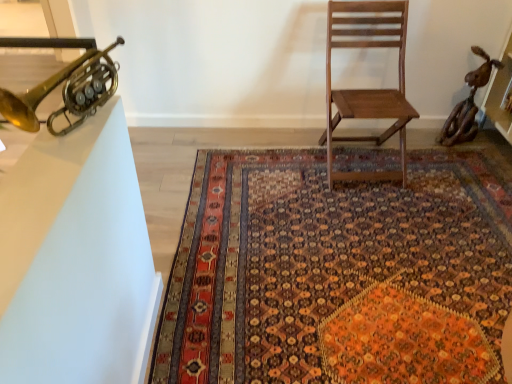
This screenshot has width=512, height=384. Identify the location of carpet with intricate patterns at center. (338, 273).

Image resolution: width=512 pixels, height=384 pixels. What do you see at coordinates (76, 260) in the screenshot? I see `white glossy table at left` at bounding box center [76, 260].

Where is `carpet with intricate patterns at center`? The image size is (512, 384). carpet with intricate patterns at center is located at coordinates (338, 273).

Which of these two, carpet with intricate patterns at center or white glossy table at left, is thinner?

white glossy table at left.

In the scene shown: Which object is further away from the camera taking this photo, carpet with intricate patterns at center or white glossy table at left?

carpet with intricate patterns at center is further away from the camera.

Is carpet with intricate patterns at center taller than white glossy table at left?

Correct, carpet with intricate patterns at center is much taller as white glossy table at left.

Does wooden chair at center have a greater width compared to white glossy table at left?

Yes.

Could you tell me if wooden chair at center is turned towards white glossy table at left?

No, wooden chair at center does not turn towards white glossy table at left.

Does point (327, 68) appear closer or farther from the camera than point (2, 319)?

Point (327, 68).

Considering the relative positions of wooden chair at center and white glossy table at left in the image provided, is wooden chair at center to the left or to the right of white glossy table at left?

In the image, wooden chair at center appears on the right side of white glossy table at left.

Is gold brass trumpet at upper left wider than carpet with intricate patterns at center?

A: No.

Is gold brass trumpet at upper left positioned with its back to carpet with intricate patterns at center?

gold brass trumpet at upper left is not turned away from carpet with intricate patterns at center.

Can you confirm if gold brass trumpet at upper left is taller than carpet with intricate patterns at center?

Indeed, gold brass trumpet at upper left has a greater height compared to carpet with intricate patterns at center.

Who is more distant, gold brass trumpet at upper left or carpet with intricate patterns at center?

Positioned behind is carpet with intricate patterns at center.

Is there a large distance between wooden chair at center and carpet with intricate patterns at center?

They are positioned close to each other.

From a real-world perspective, is wooden chair at center positioned above or below carpet with intricate patterns at center?

wooden chair at center is situated higher than carpet with intricate patterns at center in the real world.

Looking at the image, does wooden chair at center seem bigger or smaller compared to carpet with intricate patterns at center?

Considering their sizes, wooden chair at center takes up more space than carpet with intricate patterns at center.

How different are the orientations of wooden chair at center and carpet with intricate patterns at center in degrees?

91.6 degrees.

Is gold brass trumpet at upper left at the left side of wooden chair at center?

Indeed, gold brass trumpet at upper left is positioned on the left side of wooden chair at center.

Does gold brass trumpet at upper left touch wooden chair at center?

gold brass trumpet at upper left and wooden chair at center are not in contact.

In the image, is gold brass trumpet at upper left positioned in front of or behind wooden chair at center?

In the image, gold brass trumpet at upper left appears in front of wooden chair at center.

Considering the sizes of gold brass trumpet at upper left and wooden chair at center in the image, is gold brass trumpet at upper left taller or shorter than wooden chair at center?

gold brass trumpet at upper left is shorter than wooden chair at center.

How much distance is there between wooden chair at center and gold brass trumpet at upper left?

The distance of wooden chair at center from gold brass trumpet at upper left is 4.79 feet.

Are wooden chair at center and gold brass trumpet at upper left located far from each other?

wooden chair at center is positioned a significant distance from gold brass trumpet at upper left.

Is wooden chair at center in front of or behind gold brass trumpet at upper left in the image?

Visually, wooden chair at center is located behind gold brass trumpet at upper left.

Is point (351, 17) closer or farther from the camera than point (109, 71)?

Point (351, 17) is positioned farther from the camera compared to point (109, 71).

Looking at this image, is white glossy table at left thinner than carpet with intricate patterns at center?

Yes.

Is white glossy table at left turned away from carpet with intricate patterns at center?

No, carpet with intricate patterns at center is not at the back of white glossy table at left.

Based on the photo, which of these two, white glossy table at left or carpet with intricate patterns at center, is smaller?

Smaller between the two is white glossy table at left.

From the image's perspective, would you say white glossy table at left is positioned over carpet with intricate patterns at center?

Yes, from the image's perspective, white glossy table at left is over carpet with intricate patterns at center.

Find the location of a particular element. table located above the carpet with intricate patterns at center (from a real-world perspective) is located at coordinates (76, 260).

I want to click on chair behind the white glossy table at left, so click(368, 89).

Based on the photo, estimate the real-world distances between objects in this image. Which object is closer to gold brass trumpet at upper left, white glossy table at left or wooden chair at center?

white glossy table at left is positioned closer to the anchor gold brass trumpet at upper left.

Based on their spatial positions, is gold brass trumpet at upper left or wooden chair at center closer to carpet with intricate patterns at center?

Among the two, wooden chair at center is located nearer to carpet with intricate patterns at center.

Looking at this image, which object lies nearer to the anchor point gold brass trumpet at upper left, carpet with intricate patterns at center or white glossy table at left?

white glossy table at left lies closer to gold brass trumpet at upper left than the other object.

When comparing their distances from white glossy table at left, does wooden chair at center or carpet with intricate patterns at center seem further?

wooden chair at center is positioned further to the anchor white glossy table at left.

Based on the photo, when comparing their distances from white glossy table at left, does carpet with intricate patterns at center or wooden chair at center seem further?

The object further to white glossy table at left is wooden chair at center.

Considering their positions, is white glossy table at left positioned further to gold brass trumpet at upper left than carpet with intricate patterns at center?

carpet with intricate patterns at center lies further to gold brass trumpet at upper left than the other object.

When comparing their distances from carpet with intricate patterns at center, does gold brass trumpet at upper left or white glossy table at left seem closer?

Based on the image, white glossy table at left appears to be nearer to carpet with intricate patterns at center.

Consider the image. Based on their spatial positions, is wooden chair at center or gold brass trumpet at upper left closer to carpet with intricate patterns at center?

wooden chair at center is positioned closer to the anchor carpet with intricate patterns at center.

Where is `trumpet located between white glossy table at left and wooden chair at center in the depth direction`? The height and width of the screenshot is (384, 512). trumpet located between white glossy table at left and wooden chair at center in the depth direction is located at coordinates (66, 92).

Where is `table between gold brass trumpet at upper left and carpet with intricate patterns at center from left to right`? table between gold brass trumpet at upper left and carpet with intricate patterns at center from left to right is located at coordinates (76, 260).

Find the location of a particular element. The width and height of the screenshot is (512, 384). mat positioned between white glossy table at left and wooden chair at center from near to far is located at coordinates (338, 273).

Locate an element on the screen. This screenshot has width=512, height=384. mat between gold brass trumpet at upper left and wooden chair at center in the horizontal direction is located at coordinates (338, 273).